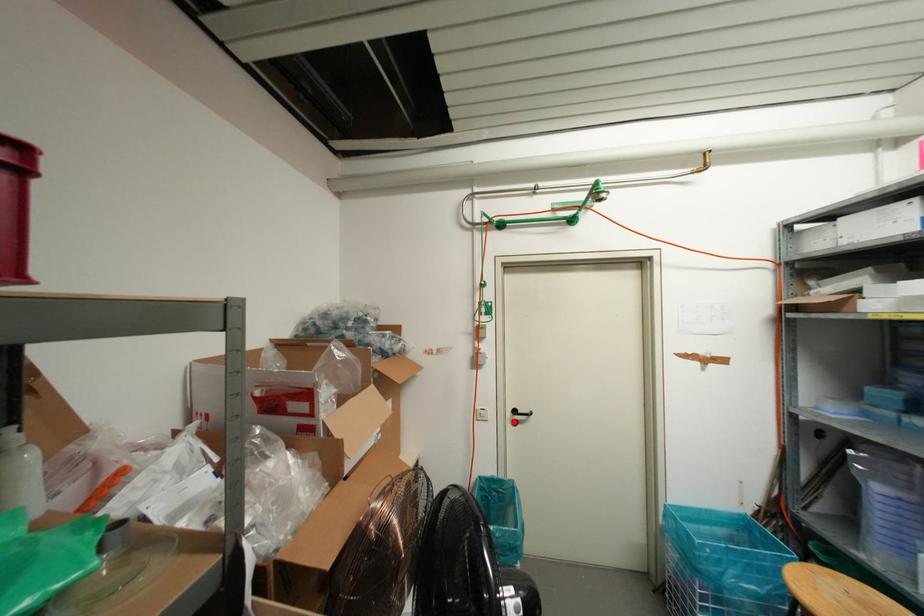
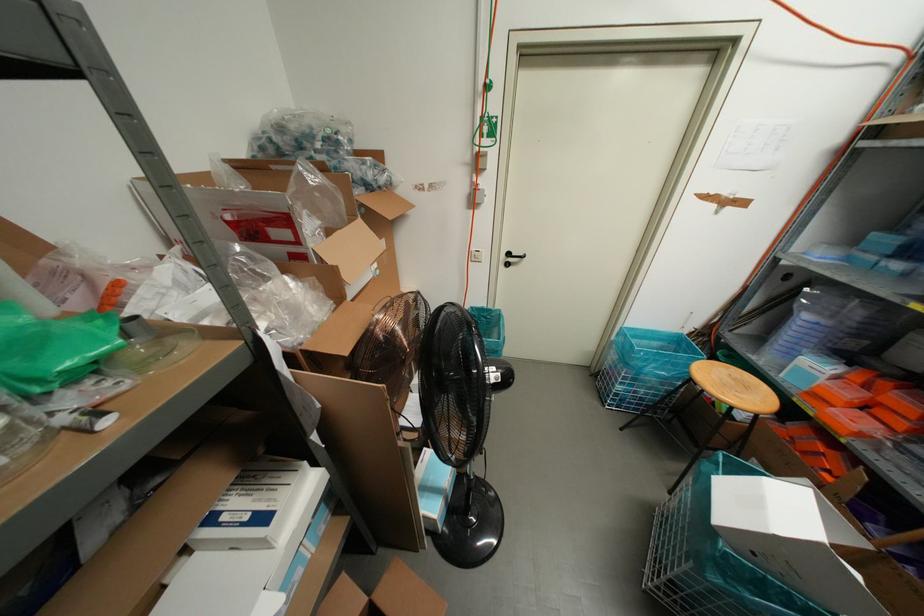
Locate, in the second image, the point that corresponds to the highlighted location in the first image.

(506, 264)